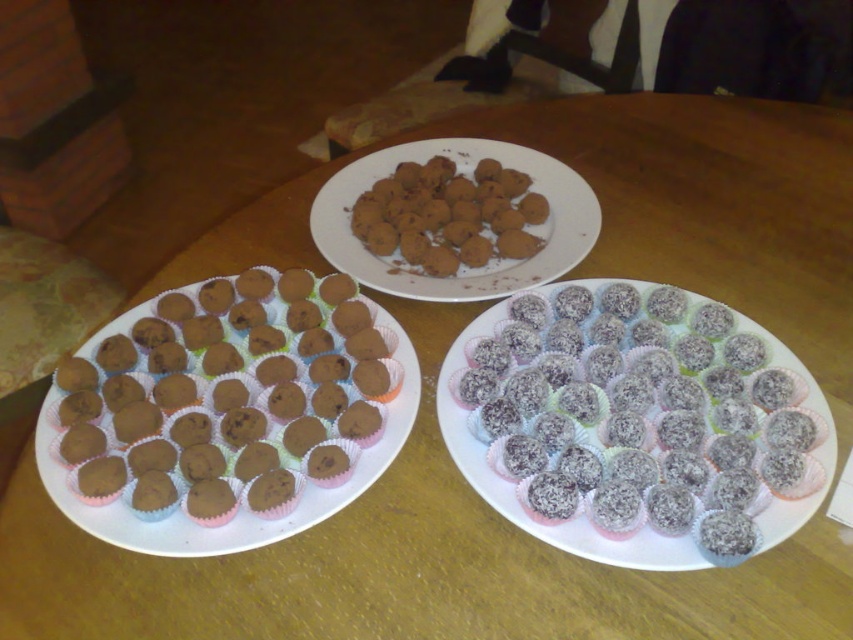
From the picture: Does white coconut-coated muffins at center come behind brown matte chocolate truffles at center?

No, white coconut-coated muffins at center is closer to the viewer.

The width and height of the screenshot is (853, 640). What do you see at coordinates (635, 422) in the screenshot? I see `white coconut-coated muffins at center` at bounding box center [635, 422].

Does point (579, 428) lie in front of point (335, 246)?

Yes, point (579, 428) is in front of point (335, 246).

Where is `white coconut-coated muffins at center`? The width and height of the screenshot is (853, 640). white coconut-coated muffins at center is located at coordinates (635, 422).

Which is above, white coconut-coated muffins at center or chocolate matte muffins at left?

chocolate matte muffins at left

Is point (735, 440) more distant than point (245, 284)?

No, (735, 440) is in front of (245, 284).

The image size is (853, 640). I want to click on white coconut-coated muffins at center, so click(635, 422).

Based on the photo, is chocolate matte muffins at left smaller than brown matte chocolate truffles at center?

Indeed, chocolate matte muffins at left has a smaller size compared to brown matte chocolate truffles at center.

Is chocolate matte muffins at left thinner than brown matte chocolate truffles at center?

Indeed, chocolate matte muffins at left has a lesser width compared to brown matte chocolate truffles at center.

This screenshot has height=640, width=853. In order to click on chocolate matte muffins at left in this screenshot , I will do `click(227, 397)`.

Where is `chocolate matte muffins at left`? Image resolution: width=853 pixels, height=640 pixels. chocolate matte muffins at left is located at coordinates (227, 397).